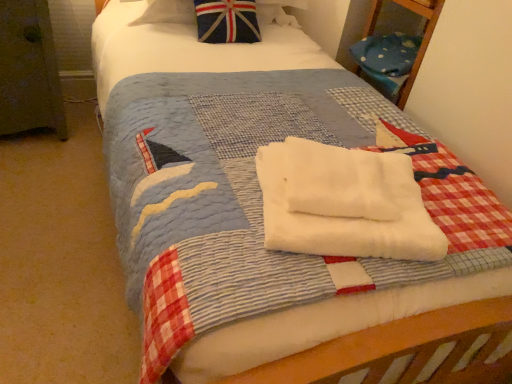
You are a GUI agent. You are given a task and a screenshot of the screen. Output one action in this format:
    pyautogui.click(x=<x>, y=<y>)
    Task: Click on the white soft towel at center, the first beach towel ordered from the bottom
    The image size is (512, 384).
    Given the screenshot: What is the action you would take?
    pyautogui.click(x=344, y=203)

The image size is (512, 384). What are the coordinates of `white soft towel at center, the 2th beach towel in the bottom-to-top sequence` in the screenshot? It's located at (337, 182).

From a real-world perspective, which is physically below, union jack fabric pillow at upper center or white soft towel at center, which is counted as the first beach towel, starting from the top?

In real-world perspective, union jack fabric pillow at upper center is lower.

Who is smaller, union jack fabric pillow at upper center or white soft towel at center, the 2th beach towel in the bottom-to-top sequence?

With smaller size is white soft towel at center, the 2th beach towel in the bottom-to-top sequence.

In terms of width, does union jack fabric pillow at upper center look wider or thinner when compared to white soft towel at center, which is counted as the first beach towel, starting from the top?

In the image, union jack fabric pillow at upper center appears to be wider than white soft towel at center, which is counted as the first beach towel, starting from the top.

From the image's perspective, relative to white soft towel at center, the 2th beach towel in the bottom-to-top sequence, is union jack fabric pillow at upper center above or below?

union jack fabric pillow at upper center is above white soft towel at center, the 2th beach towel in the bottom-to-top sequence.

Would you say union jack fabric pillow at upper center is a long distance from white soft towel at center, the first beach towel ordered from the bottom?

Yes, union jack fabric pillow at upper center and white soft towel at center, the first beach towel ordered from the bottom, are located far from each other.

From a real-world perspective, is union jack fabric pillow at upper center positioned under white soft towel at center, the first beach towel ordered from the bottom, based on gravity?

No, from a real-world perspective, union jack fabric pillow at upper center is not beneath white soft towel at center, the first beach towel ordered from the bottom.

From the image's perspective, does union jack fabric pillow at upper center appear lower than white soft towel at center, the first beach towel ordered from the bottom?

No, from the image's perspective, union jack fabric pillow at upper center is not below white soft towel at center, the first beach towel ordered from the bottom.

Considering the sizes of objects union jack fabric pillow at upper center and white soft towel at center, the first beach towel ordered from the bottom, in the image provided, who is wider, union jack fabric pillow at upper center or white soft towel at center, the first beach towel ordered from the bottom,?

union jack fabric pillow at upper center is wider.

From a real-world perspective, which is physically below, white soft towel at center, the first beach towel ordered from the bottom, or white soft towel at center, the 2th beach towel in the bottom-to-top sequence?

white soft towel at center, the first beach towel ordered from the bottom, is physically lower.

Does point (346, 206) come closer to viewer compared to point (374, 159)?

That is True.

Would you say white soft towel at center, the first beach towel ordered from the bottom, is outside white soft towel at center, which is counted as the first beach towel, starting from the top?

No, most part of white soft towel at center, the first beach towel ordered from the bottom, lies within white soft towel at center, which is counted as the first beach towel, starting from the top.

Based on their positions, is white soft towel at center, which is the second beach towel from top to bottom, located to the left or right of white soft towel at center, which is counted as the first beach towel, starting from the top?

Clearly, white soft towel at center, which is the second beach towel from top to bottom, is on the right of white soft towel at center, which is counted as the first beach towel, starting from the top, in the image.

Measure the distance between white soft towel at center, which is counted as the first beach towel, starting from the top, and union jack fabric pillow at upper center.

white soft towel at center, which is counted as the first beach towel, starting from the top, is 3.85 feet from union jack fabric pillow at upper center.

Are white soft towel at center, which is counted as the first beach towel, starting from the top, and union jack fabric pillow at upper center making contact?

No, white soft towel at center, which is counted as the first beach towel, starting from the top, is not touching union jack fabric pillow at upper center.

Considering the sizes of objects white soft towel at center, which is counted as the first beach towel, starting from the top, and union jack fabric pillow at upper center in the image provided, who is bigger, white soft towel at center, which is counted as the first beach towel, starting from the top, or union jack fabric pillow at upper center?

Bigger between the two is union jack fabric pillow at upper center.

Which is behind, white soft towel at center, which is counted as the first beach towel, starting from the top, or union jack fabric pillow at upper center?

union jack fabric pillow at upper center is behind.

Considering the points (331, 166) and (334, 241), which point is behind, point (331, 166) or point (334, 241)?

Point (331, 166)

Are white soft towel at center, which is counted as the first beach towel, starting from the top, and white soft towel at center, the first beach towel ordered from the bottom, beside each other?

Yes, white soft towel at center, which is counted as the first beach towel, starting from the top, is with white soft towel at center, the first beach towel ordered from the bottom.

You are a GUI agent. You are given a task and a screenshot of the screen. Output one action in this format:
    pyautogui.click(x=<x>, y=<y>)
    Task: Click on the beach towel in front of the white soft towel at center, the 2th beach towel in the bottom-to-top sequence
    
    Given the screenshot: What is the action you would take?
    pyautogui.click(x=344, y=203)

In the scene shown: Is white soft towel at center, the 2th beach towel in the bottom-to-top sequence, aimed at white soft towel at center, which is the second beach towel from top to bottom?

Yes, white soft towel at center, the 2th beach towel in the bottom-to-top sequence, is oriented towards white soft towel at center, which is the second beach towel from top to bottom.

Is white soft towel at center, which is the second beach towel from top to bottom, aimed at union jack fabric pillow at upper center?

No.

Does point (282, 185) come behind point (153, 20)?

No, (282, 185) is in front of (153, 20).

Is white soft towel at center, which is the second beach towel from top to bottom, positioned far away from union jack fabric pillow at upper center?

Absolutely, white soft towel at center, which is the second beach towel from top to bottom, is distant from union jack fabric pillow at upper center.

Locate an element on the screen. The image size is (512, 384). the 1st beach towel in front of the union jack fabric pillow at upper center, starting your count from the anchor is located at coordinates (337, 182).

The image size is (512, 384). I want to click on pillow above the white soft towel at center, which is the second beach towel from top to bottom (from a real-world perspective), so click(x=166, y=12).

Based on their spatial positions, is white soft towel at center, which is the second beach towel from top to bottom, or union jack fabric pillow at upper center closer to white soft towel at center, the 2th beach towel in the bottom-to-top sequence?

white soft towel at center, which is the second beach towel from top to bottom, lies closer to white soft towel at center, the 2th beach towel in the bottom-to-top sequence, than the other object.

When comparing their distances from white soft towel at center, which is the second beach towel from top to bottom, does union jack fabric pillow at upper center or white soft towel at center, the 2th beach towel in the bottom-to-top sequence, seem closer?

white soft towel at center, the 2th beach towel in the bottom-to-top sequence.

Based on their spatial positions, is white soft towel at center, the first beach towel ordered from the bottom, or white soft towel at center, the 2th beach towel in the bottom-to-top sequence, closer to union jack fabric pillow at upper center?

white soft towel at center, the 2th beach towel in the bottom-to-top sequence, is positioned closer to the anchor union jack fabric pillow at upper center.

Based on their spatial positions, is union jack fabric pillow at upper center or white soft towel at center, the first beach towel ordered from the bottom, closer to white soft towel at center, which is counted as the first beach towel, starting from the top?

Based on the image, white soft towel at center, the first beach towel ordered from the bottom, appears to be nearer to white soft towel at center, which is counted as the first beach towel, starting from the top.

From the image, which object appears to be farther from union jack fabric pillow at upper center, white soft towel at center, the 2th beach towel in the bottom-to-top sequence, or white soft towel at center, the first beach towel ordered from the bottom?

white soft towel at center, the first beach towel ordered from the bottom, is further to union jack fabric pillow at upper center.

Which object lies further to the anchor point white soft towel at center, which is the second beach towel from top to bottom, white soft towel at center, the 2th beach towel in the bottom-to-top sequence, or union jack fabric pillow at upper center?

union jack fabric pillow at upper center.

At what (x,y) coordinates should I click in order to perform the action: click on beach towel that lies between union jack fabric pillow at upper center and white soft towel at center, which is the second beach towel from top to bottom, from top to bottom. Please return your answer as a coordinate pair (x, y). Looking at the image, I should click on (337, 182).